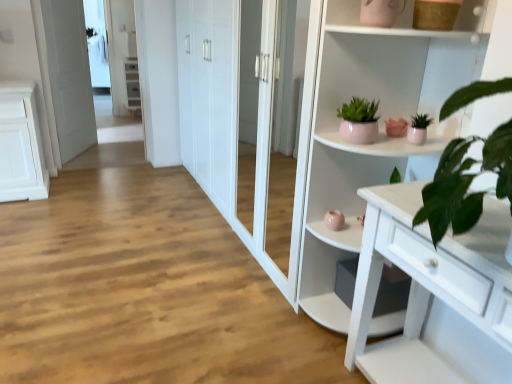
Question: Considering the relative sizes of white glossy cabinet at upper left and white glossy cupboard at upper right in the image provided, is white glossy cabinet at upper left bigger than white glossy cupboard at upper right?

Choices:
 (A) yes
 (B) no

Answer: (B)

Question: Is white glossy cabinet at upper left not inside white glossy cupboard at upper right?

Choices:
 (A) yes
 (B) no

Answer: (A)

Question: Considering the relative sizes of white glossy cabinet at upper left and white glossy cupboard at upper right in the image provided, is white glossy cabinet at upper left shorter than white glossy cupboard at upper right?

Choices:
 (A) yes
 (B) no

Answer: (A)

Question: Are white glossy cabinet at upper left and white glossy cupboard at upper right far apart?

Choices:
 (A) no
 (B) yes

Answer: (B)

Question: From a real-world perspective, is white glossy cabinet at upper left on white glossy cupboard at upper right?

Choices:
 (A) no
 (B) yes

Answer: (A)

Question: Considering the positions of pink ceramic houseplant at upper right, arranged as the second houseplant when viewed from the left, and white glossy door at left in the image, is pink ceramic houseplant at upper right, arranged as the second houseplant when viewed from the left, bigger or smaller than white glossy door at left?

Choices:
 (A) big
 (B) small

Answer: (B)

Question: In terms of height, does pink ceramic houseplant at upper right, acting as the first houseplant starting from the right, look taller or shorter compared to white glossy door at left?

Choices:
 (A) short
 (B) tall

Answer: (A)

Question: Considering the positions of pink ceramic houseplant at upper right, acting as the first houseplant starting from the right, and white glossy door at left in the image, is pink ceramic houseplant at upper right, acting as the first houseplant starting from the right, wider or thinner than white glossy door at left?

Choices:
 (A) thin
 (B) wide

Answer: (A)

Question: Is pink ceramic houseplant at upper right, arranged as the second houseplant when viewed from the left, in front of or behind white glossy door at left in the image?

Choices:
 (A) front
 (B) behind

Answer: (A)

Question: From a real-world perspective, is white glossy cupboard at upper right physically located above or below matte pink pot at upper center, the 1th houseplant from the left?

Choices:
 (A) above
 (B) below

Answer: (B)

Question: Is point (455, 44) closer or farther from the camera than point (375, 129)?

Choices:
 (A) farther
 (B) closer

Answer: (A)

Question: From their relative heights in the image, would you say white glossy cupboard at upper right is taller or shorter than matte pink pot at upper center, which appears as the 2th houseplant when viewed from the right?

Choices:
 (A) tall
 (B) short

Answer: (A)

Question: Based on their sizes in the image, would you say white glossy cupboard at upper right is bigger or smaller than matte pink pot at upper center, which appears as the 2th houseplant when viewed from the right?

Choices:
 (A) big
 (B) small

Answer: (A)

Question: Choose the correct answer: Is white glossy door at left inside matte pink pot at upper center, the 1th houseplant from the left, or outside it?

Choices:
 (A) inside
 (B) outside

Answer: (B)

Question: Is white glossy door at left in front of or behind matte pink pot at upper center, which appears as the 2th houseplant when viewed from the right, in the image?

Choices:
 (A) front
 (B) behind

Answer: (B)